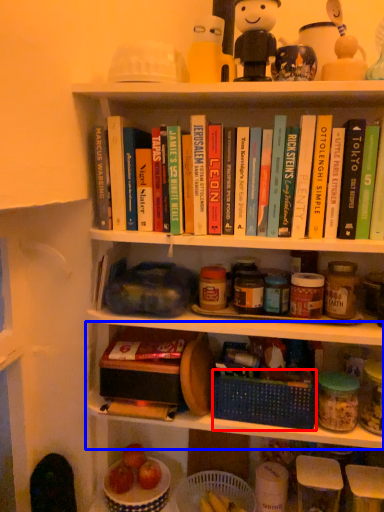
Question: Which of the following is the closest to the observer, basket (highlighted by a red box) or shelf (highlighted by a blue box)?

Choices:
 (A) basket
 (B) shelf

Answer: (B)